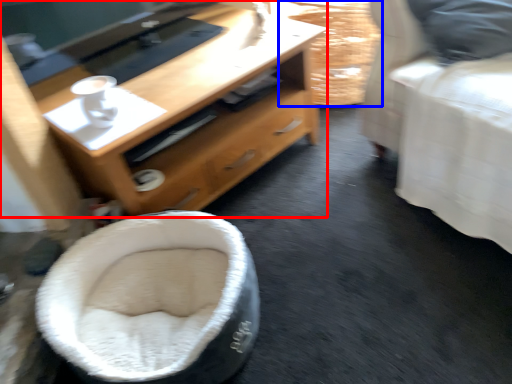
Question: Which object appears closest to the camera in this image, desk (highlighted by a red box) or basket (highlighted by a blue box)?

Choices:
 (A) desk
 (B) basket

Answer: (A)